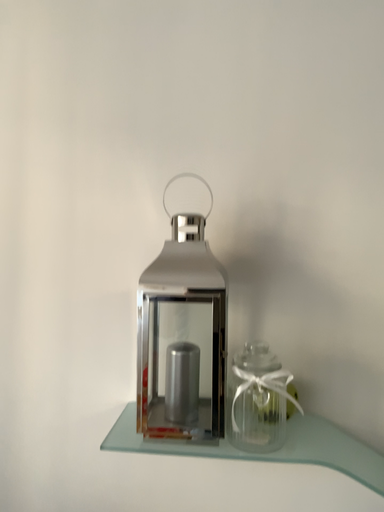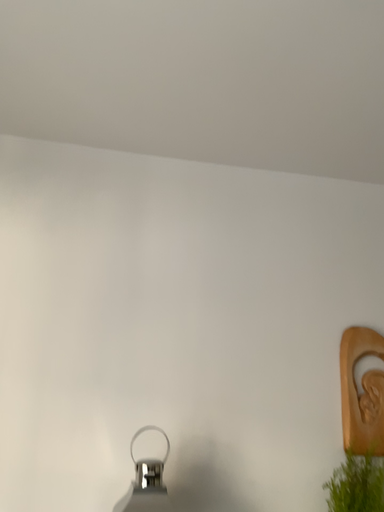
Question: Which way did the camera rotate in the video?

Choices:
 (A) rotated upward
 (B) rotated downward

Answer: (A)